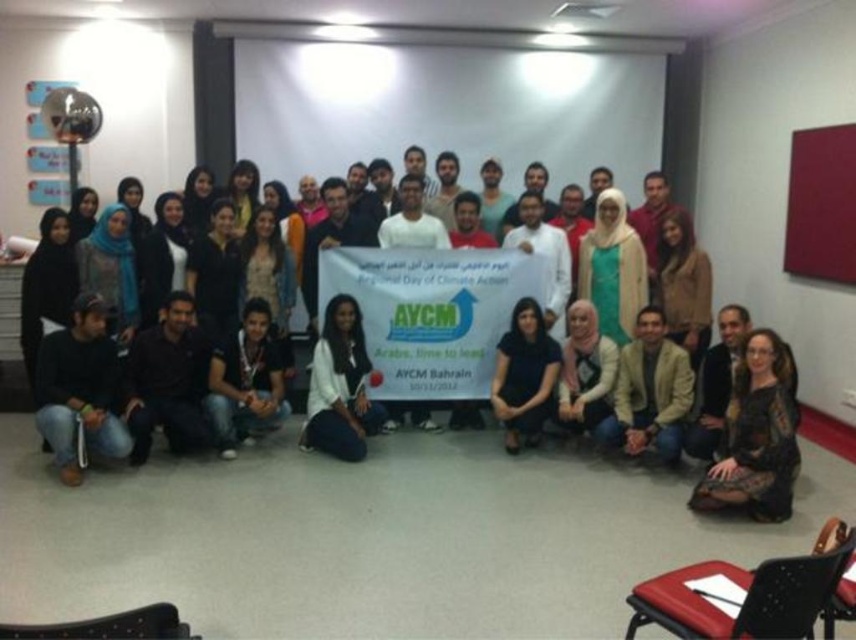
You are taking a photo of the group in the center. You want to focus on the person at point (363, 401) and the person at point (500, 387). Which of these two points is closer to the camera?

Point (363, 401) is closer to the camera than point (500, 387).

You are taking a photo of the group in the center. You want to focus on the person at point [626,364] and the person at point [504,369]. Which person should you focus on first to ensure they are in sharp focus?

You should focus on the person at point [626,364] first because they are closer to the camera than the person at point [504,369].